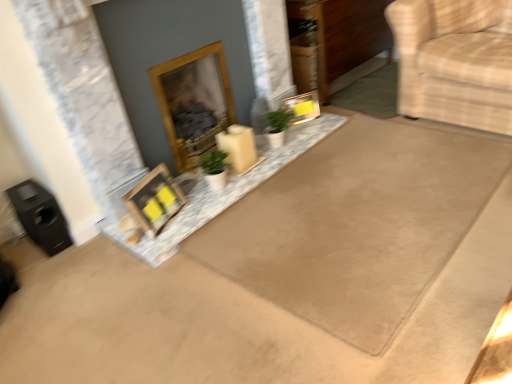
The height and width of the screenshot is (384, 512). In order to click on vacant space that's between beige fabric armchair at right and white marble tray at center in this screenshot , I will do click(x=339, y=168).